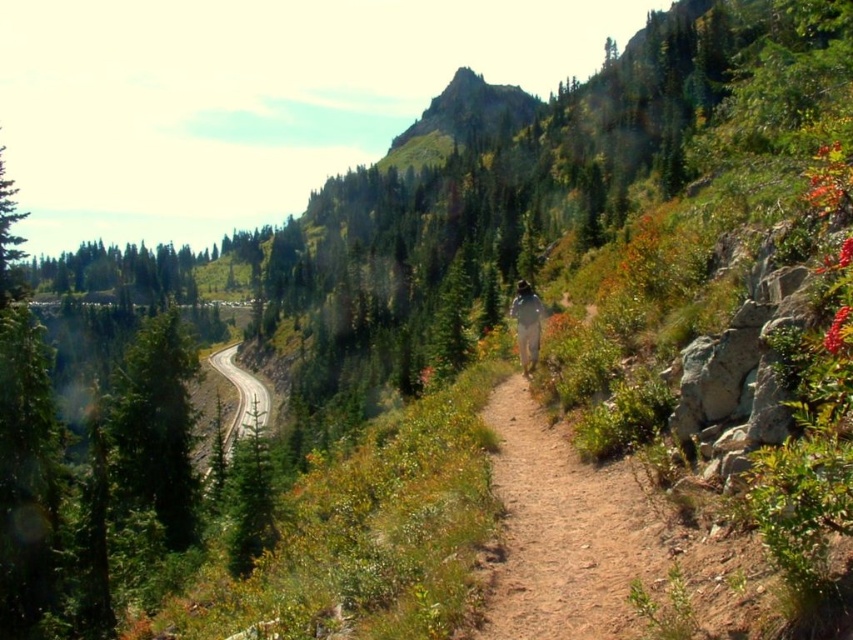
You are a hiker planning to take the dirt path in the foreground. There is a smooth asphalt road at left located at point (235, 417). Will the asphalt road at left be visible from the dirt path?

The smooth asphalt road at left is located at point (235, 417), which is along the dirt path in the foreground. Therefore, the asphalt road at left will be visible from the dirt path.

You are a hiker planning to cross the white fabric at center. The smooth asphalt road at left is a safer path. Which path is wider?

The smooth asphalt road at left is wider than the white fabric at center, so it is the safer path.

You are a hiker standing at the starting point of the trail. You see two points marked on the path ahead of you. The first point is at coordinate point (247, 394) and the second point is at coordinate point (509, 310). Which point is closer to you?

Point (247, 394) is closer to you because it is further to the camera than point (509, 310), meaning it is nearer in the scene.